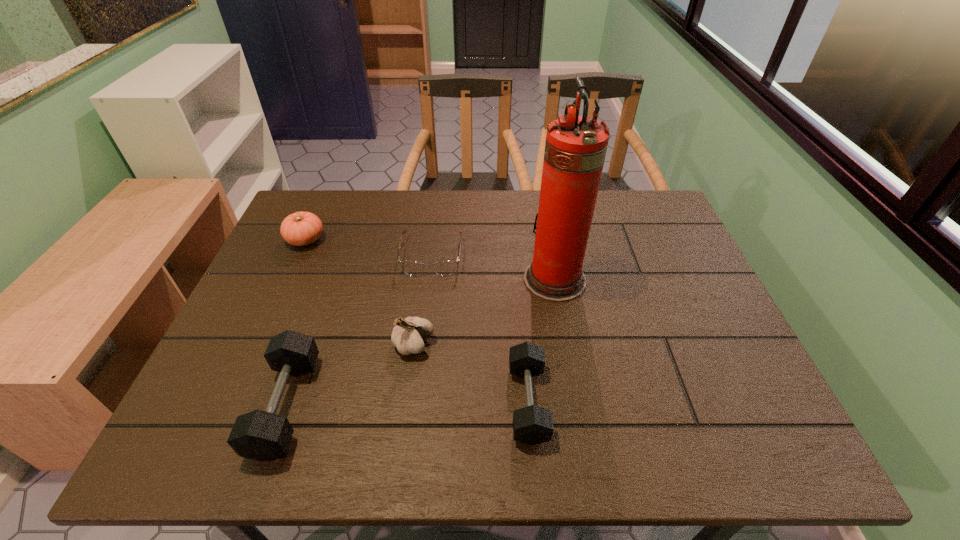
I want to click on free spot located on the back of the leftmost object, so click(324, 197).

Where is `blank space located on the left of the garlic`? This screenshot has height=540, width=960. blank space located on the left of the garlic is located at coordinates (282, 344).

The width and height of the screenshot is (960, 540). What are the coordinates of `blank area located at the discharge end of the tallest object` in the screenshot? It's located at (501, 279).

Image resolution: width=960 pixels, height=540 pixels. In order to click on vacant area situated at the discharge end of the tallest object in this screenshot , I will do `click(408, 279)`.

Identify the location of vacant space located 0.160m at the discharge end of the tallest object. (464, 279).

Find the location of a particular element. object positioned at the far edge is located at coordinates pos(301,228).

At what (x,y) coordinates should I click in order to perform the action: click on dumbbell that is positioned at the left edge. Please return your answer as a coordinate pair (x, y). Looking at the image, I should click on (260, 435).

Find the location of a particular element. tomato that is positioned at the left edge is located at coordinates (301, 228).

Locate an element on the screen. object located in the far left corner section of the desktop is located at coordinates (301, 228).

This screenshot has height=540, width=960. What are the coordinates of `object at the near left corner` in the screenshot? It's located at (260, 435).